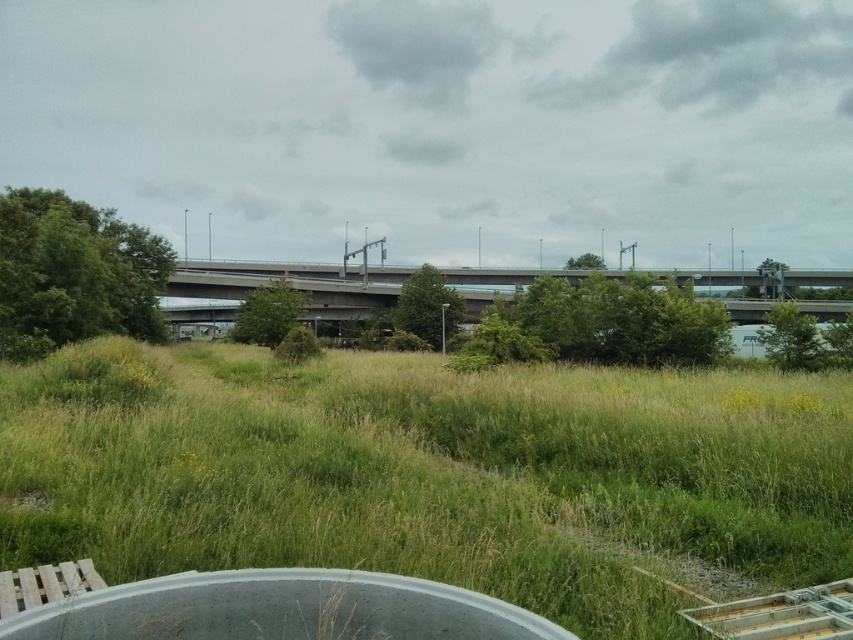
Question: Can you confirm if green grassy field at center is positioned below concrete bridge at center?

Choices:
 (A) yes
 (B) no

Answer: (A)

Question: From the image, what is the correct spatial relationship of green grassy field at center in relation to concrete bridge at center?

Choices:
 (A) below
 (B) above

Answer: (A)

Question: Considering the relative positions of green grassy field at center and concrete bridge at center in the image provided, where is green grassy field at center located with respect to concrete bridge at center?

Choices:
 (A) right
 (B) left

Answer: (B)

Question: Among these objects, which one is nearest to the camera?

Choices:
 (A) green grassy field at center
 (B) concrete bridge at center

Answer: (A)